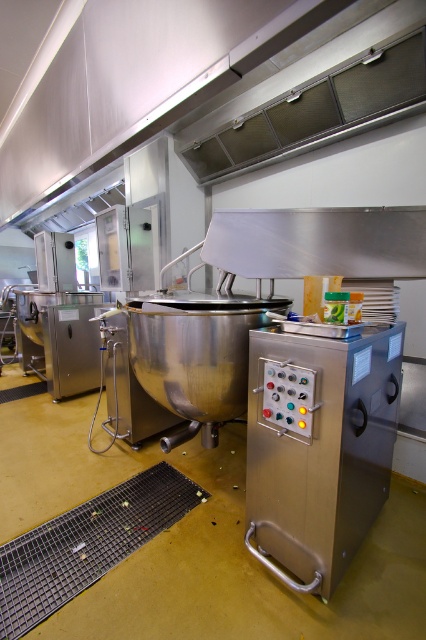
I want to click on stainless steel control panel at center, so click(319, 449).

Is stainless steel control panel at center positioned in front of polished stainless steel mixer at center?

Yes, stainless steel control panel at center is in front of polished stainless steel mixer at center.

Does point (325, 422) lie in front of point (238, 374)?

That is True.

In order to click on stainless steel control panel at center in this screenshot , I will do `click(319, 449)`.

In the scene shown: Who is higher up, polished stainless steel mixer at center or satin silver cabinet at center?

satin silver cabinet at center is above.

Is point (241, 376) in front of point (117, 243)?

Yes, it is.

Between point (175, 321) and point (100, 246), which one is positioned behind?

The point (100, 246) is behind.

Where is `polished stainless steel mixer at center`? This screenshot has height=640, width=426. polished stainless steel mixer at center is located at coordinates (195, 356).

Which of these two, polished stainless steel mixer at center or brushed metal/steel industrial mixer at left, stands shorter?

With less height is polished stainless steel mixer at center.

Locate an element on the screen. polished stainless steel mixer at center is located at coordinates (195, 356).

Does point (229, 406) come closer to viewer compared to point (71, 364)?

Yes, point (229, 406) is closer to viewer.

You are a GUI agent. You are given a task and a screenshot of the screen. Output one action in this format:
    pyautogui.click(x=<x>, y=<y>)
    Task: Click on the polished stainless steel mixer at center
    
    Given the screenshot: What is the action you would take?
    pyautogui.click(x=195, y=356)